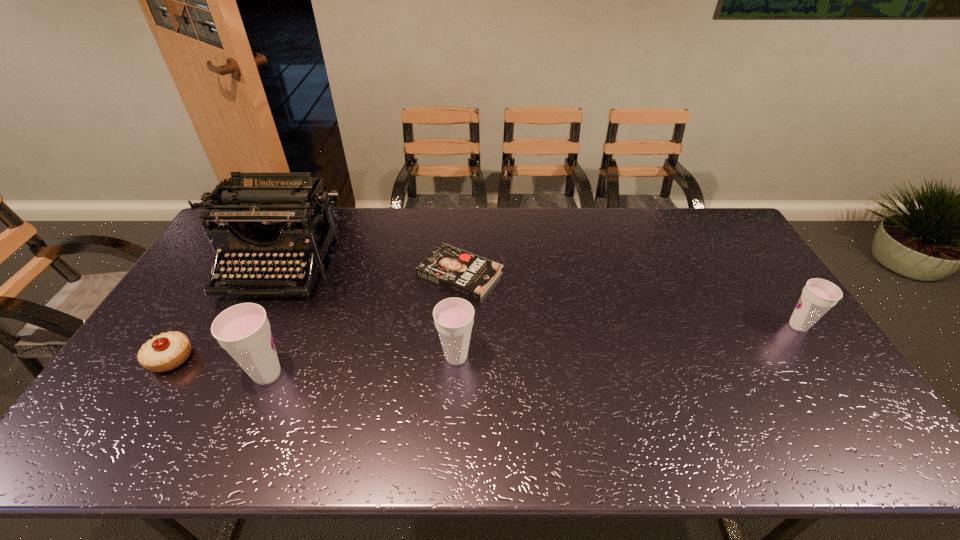
Locate an element on the screen. This screenshot has width=960, height=540. the leftmost cup is located at coordinates (243, 330).

Locate an element on the screen. The height and width of the screenshot is (540, 960). the fourth shortest object is located at coordinates (454, 317).

The image size is (960, 540). I want to click on the second shortest cup, so pyautogui.click(x=454, y=317).

I want to click on the rightmost cup, so click(x=818, y=296).

The height and width of the screenshot is (540, 960). Find the location of `the rightmost object`. the rightmost object is located at coordinates (818, 296).

Locate an element on the screen. typewriter is located at coordinates (265, 213).

This screenshot has height=540, width=960. In order to click on book in this screenshot , I will do `click(472, 276)`.

Identify the location of pastry. (167, 351).

Where is `vacant space located 0.070m on the right of the leftmost cup`? vacant space located 0.070m on the right of the leftmost cup is located at coordinates point(317,374).

Locate an element on the screen. blank area located on the left of the second cup from right to left is located at coordinates (361, 357).